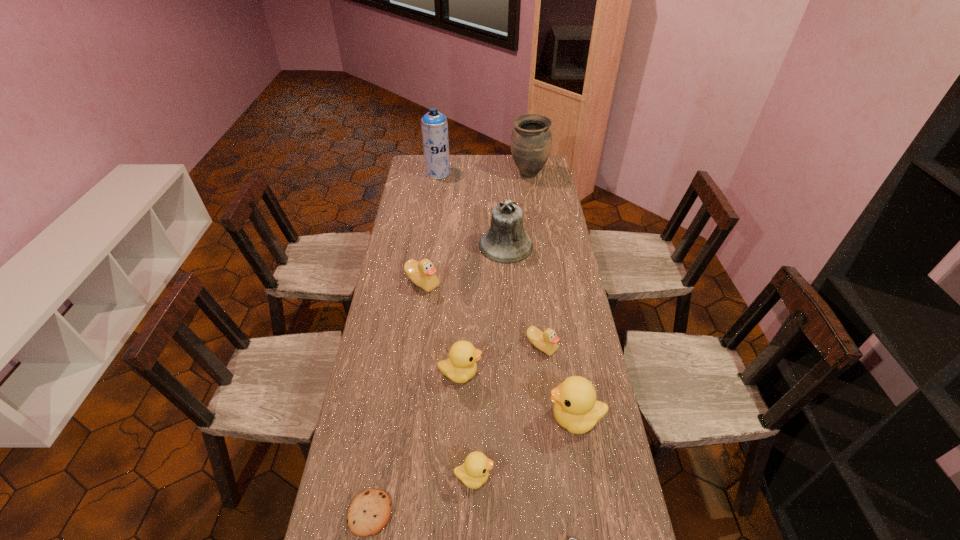
The height and width of the screenshot is (540, 960). In order to click on free space located on the face of the fourth tallest object in this screenshot , I will do `click(493, 418)`.

You are a GUI agent. You are given a task and a screenshot of the screen. Output one action in this format:
    pyautogui.click(x=<x>, y=<y>)
    Task: Click on the vacant space situated 0.100m on the face of the fourth tallest object
    The height and width of the screenshot is (540, 960).
    Given the screenshot: What is the action you would take?
    pyautogui.click(x=513, y=418)

Find the location of `blank space located 0.140m on the face of the third farthest duck`. blank space located 0.140m on the face of the third farthest duck is located at coordinates (524, 373).

Find the location of a particular element. The height and width of the screenshot is (540, 960). free region located 0.130m at the beak of the bigger beige duck is located at coordinates (418, 321).

This screenshot has height=540, width=960. I want to click on vacant space located 0.050m on the face of the nearest duck, so click(x=512, y=477).

The image size is (960, 540). I want to click on blank space located at the beak of the smaller beige duck, so (x=546, y=381).

Where is `vacant space located on the back of the cookie`? The height and width of the screenshot is (540, 960). vacant space located on the back of the cookie is located at coordinates (380, 451).

I want to click on aerosol can positioned at the far edge, so click(x=434, y=125).

Find the location of `urn that is at the far edge`. urn that is at the far edge is located at coordinates (531, 140).

Identify the location of aerosol can located at the left edge. (434, 125).